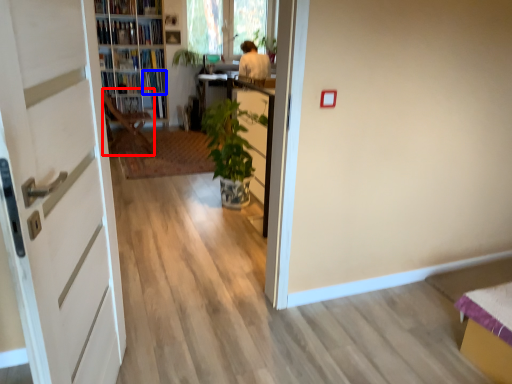
Question: Which object is further to the camera taking this photo, chair (highlighted by a red box) or book (highlighted by a blue box)?

Choices:
 (A) chair
 (B) book

Answer: (B)